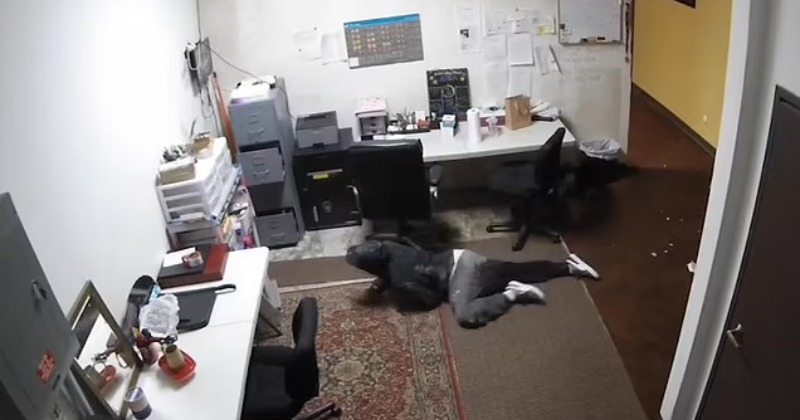
The width and height of the screenshot is (800, 420). I want to click on decorative rug, so click(381, 357).